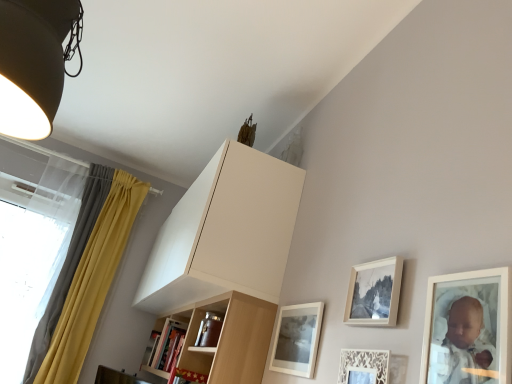
Question: From the image's perspective, is matte white picture frame at lower center, which is the first picture frame in back-to-front order, positioned above or below matte black lampshade at upper left?

Choices:
 (A) above
 (B) below

Answer: (B)

Question: Is matte white picture frame at lower center, the 4th picture frame in the front-to-back sequence, bigger or smaller than matte black lampshade at upper left?

Choices:
 (A) big
 (B) small

Answer: (B)

Question: Estimate the real-world distances between objects in this image. Which object is farther from the matte white picture frame at upper right, the fourth picture frame from the back?

Choices:
 (A) translucent fabric at left
 (B) yellow fabric curtain at left
 (C) matte white picture frame at upper right, marked as the 3th picture frame in a front-to-back arrangement
 (D) white lace picture frame at lower right, the 2th picture frame in the front-to-back sequence
 (E) matte white picture frame at lower center, which is the first picture frame in back-to-front order

Answer: (A)

Question: Based on their relative distances, which object is nearer to the wooden shelf at lower left?

Choices:
 (A) white lace picture frame at lower right, which is counted as the 3th picture frame, starting from the back
 (B) matte black lampshade at upper left
 (C) matte white picture frame at upper right, which appears as the 1th picture frame when viewed from the front
 (D) translucent fabric at left
 (E) matte white picture frame at upper right, marked as the 3th picture frame in a front-to-back arrangement

Answer: (D)